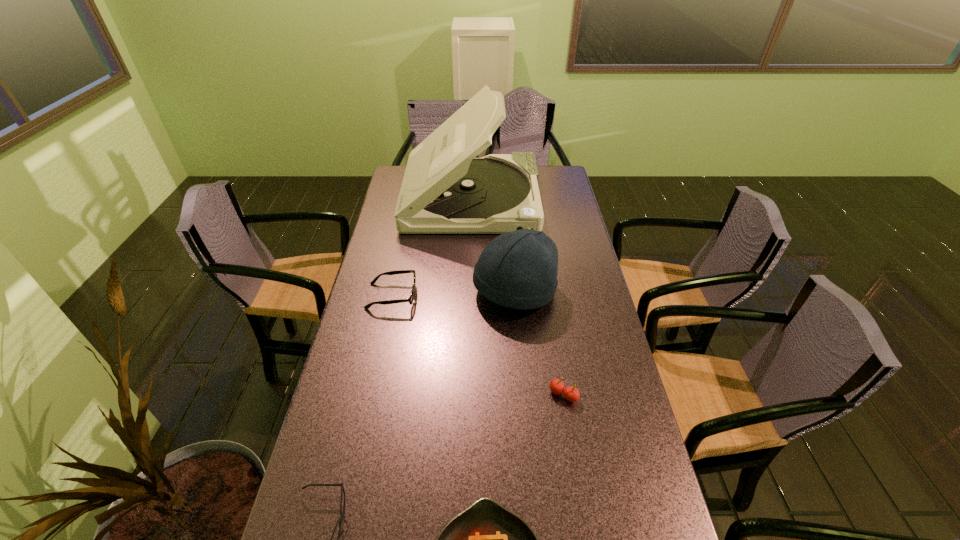
The image size is (960, 540). I want to click on vacant area at the right edge of the desktop, so click(592, 299).

In the image, there is a desktop. What are the coordinates of `vacant space at the far right corner` in the screenshot? It's located at (562, 185).

Where is `empty location between the fifth shortest object and the fourth farthest object`? Image resolution: width=960 pixels, height=540 pixels. empty location between the fifth shortest object and the fourth farthest object is located at coordinates (539, 343).

Identify the location of free area in between the taller spectacles and the CD player. (432, 247).

This screenshot has height=540, width=960. In order to click on empty space between the farther spectacles and the skullcap in this screenshot , I will do `click(453, 294)`.

Find the location of `vacant point located between the taller spectacles and the skullcap`. vacant point located between the taller spectacles and the skullcap is located at coordinates (453, 294).

Select which object appears as the second closest to the shorter spectacles. Please provide its 2D coordinates. Your answer should be formatted as a tuple, i.e. [(x, y)], where the tuple contains the x and y coordinates of a point satisfying the conditions above.

[(570, 393)]

Locate an element on the screen. The width and height of the screenshot is (960, 540). object that stands as the second closest to the frying pan is located at coordinates (570, 393).

Where is `blank area in the image that satisfies the following two spatial constraints: 1. on the lenses of the third shortest object; 2. on the left side of the fourth farthest object`? blank area in the image that satisfies the following two spatial constraints: 1. on the lenses of the third shortest object; 2. on the left side of the fourth farthest object is located at coordinates (372, 395).

Identify the location of vacant area that satisfies the following two spatial constraints: 1. on the control panel of the CD player; 2. on the back side of the second tallest object. This screenshot has width=960, height=540. (469, 291).